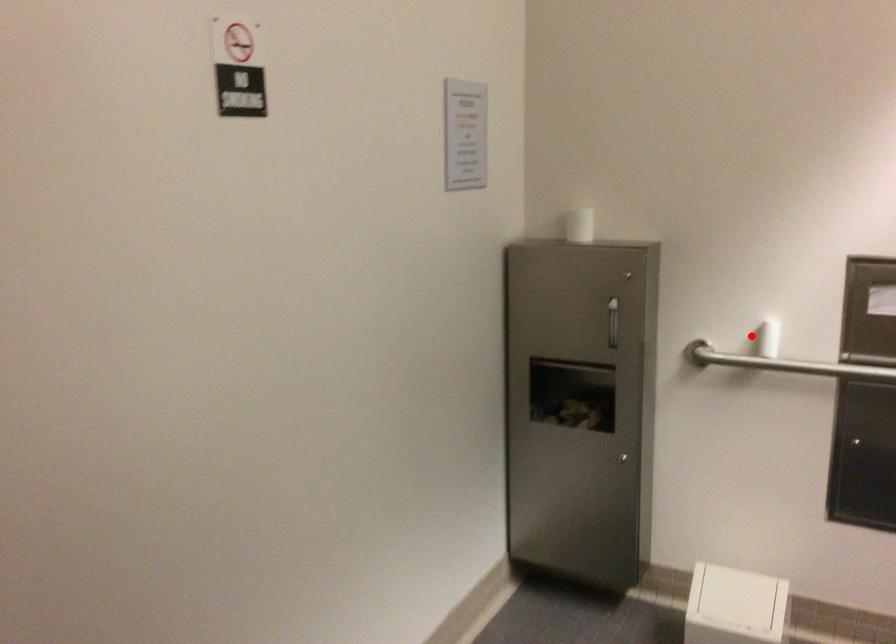
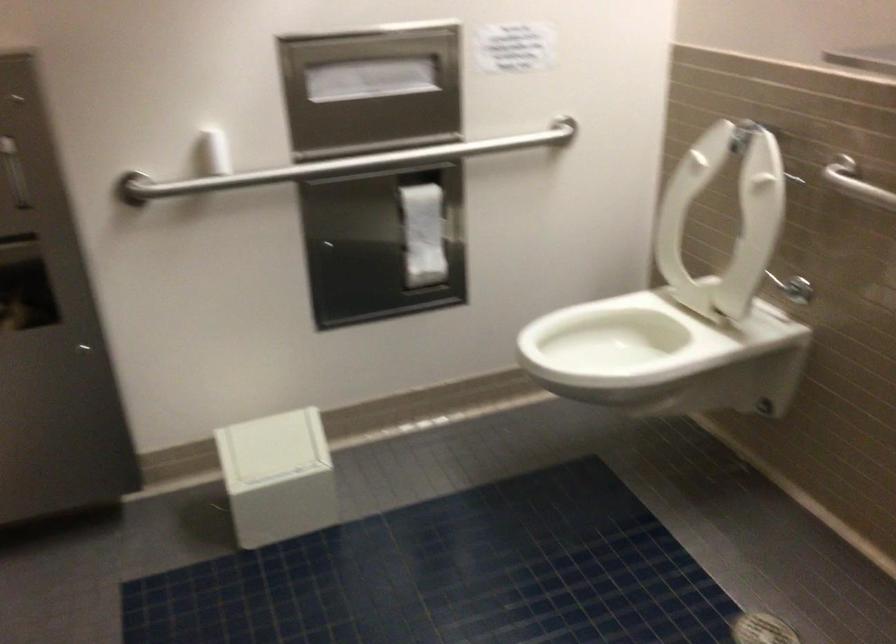
Find the pixel in the second image that matches the highlighted location in the first image.

(213, 152)